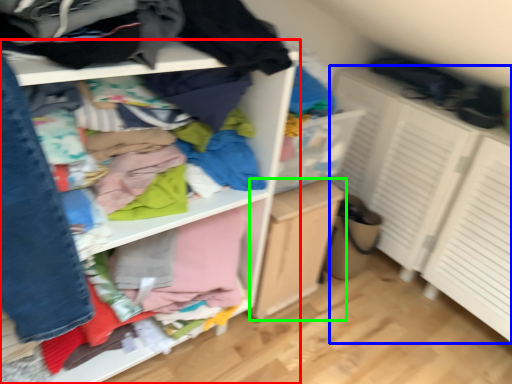
Question: Considering the real-world distances, which object is farthest from shelf (highlighted by a red box)? cabinetry (highlighted by a blue box) or file cabinet (highlighted by a green box)?

Choices:
 (A) cabinetry
 (B) file cabinet

Answer: (A)